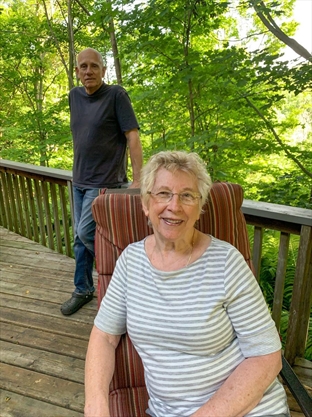
Locate an element on the screen. This screenshot has width=312, height=417. chair is located at coordinates (125, 220).